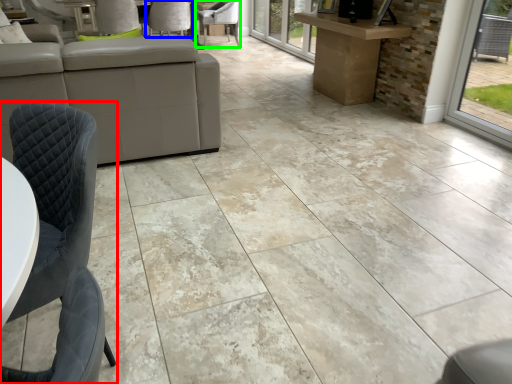
Question: Considering the real-world distances, which object is closest to chair (highlighted by a red box)? chair (highlighted by a blue box) or chair (highlighted by a green box).

Choices:
 (A) chair
 (B) chair

Answer: (A)